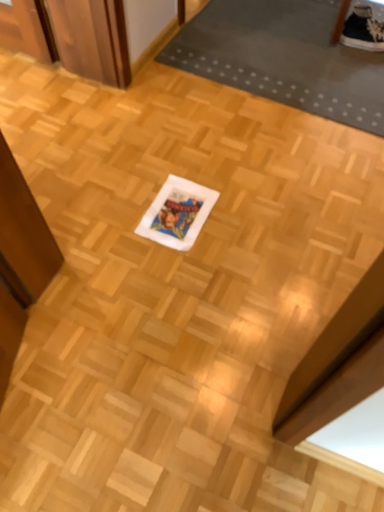
Where is `vacant location below dark gray rubber mat at upper right (from a real-world perspective)`? vacant location below dark gray rubber mat at upper right (from a real-world perspective) is located at coordinates (269, 39).